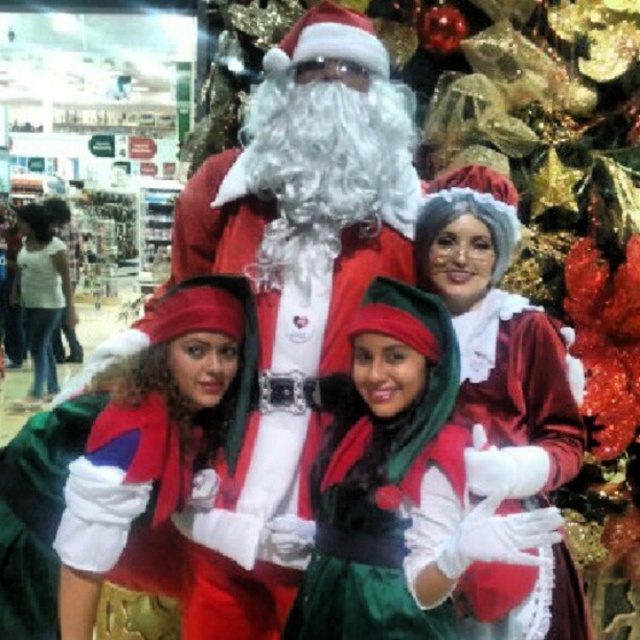
Does velvet red santa at center come behind velvet green dress at center?

Yes.

At what (x,y) coordinates should I click in order to perform the action: click on velvet red santa at center. Please return your answer as a coordinate pair (x, y). The width and height of the screenshot is (640, 640). Looking at the image, I should click on (289, 298).

This screenshot has width=640, height=640. Find the location of `velvet red santa at center`. velvet red santa at center is located at coordinates (289, 298).

Locate an element on the screen. This screenshot has width=640, height=640. velvet red santa at center is located at coordinates coord(289,298).

Is velvet red santa at center taller than velvet red dress at center?

Correct, velvet red santa at center is much taller as velvet red dress at center.

Locate an element on the screen. velvet red santa at center is located at coordinates pos(289,298).

The width and height of the screenshot is (640, 640). Find the location of `velvet red santa at center`. velvet red santa at center is located at coordinates (289, 298).

Who is more forward, (304, 605) or (490, 237)?

Point (304, 605)

Does velvet green dress at center have a lesser height compared to velvet red dress at center?

Correct, velvet green dress at center is not as tall as velvet red dress at center.

Who is more distant from viewer, (401,595) or (484,336)?

Positioned behind is point (484,336).

Find the location of a particular element. velvet green dress at center is located at coordinates (404, 493).